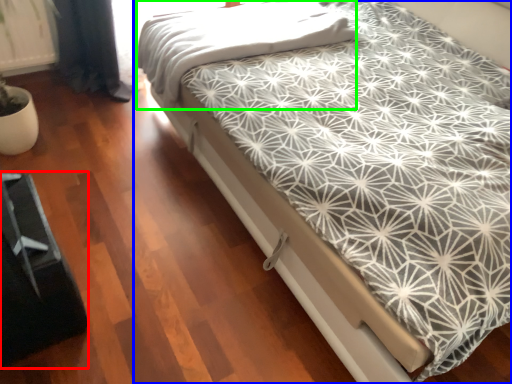
Question: Based on their relative distances, which object is nearer to bed frame (highlighted by a red box)? Choose from bed (highlighted by a blue box) and blanket (highlighted by a green box).

Choices:
 (A) bed
 (B) blanket

Answer: (A)